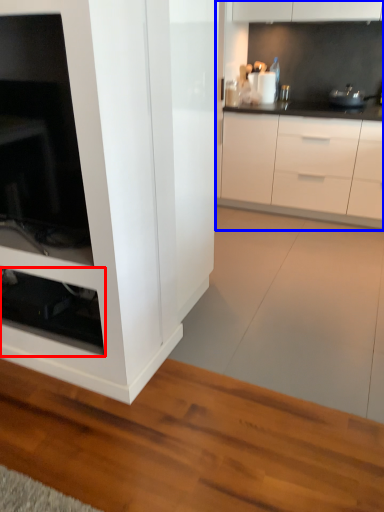
Question: Which of the following is the closest to the observer, shelf (highlighted by a red box) or cabinetry (highlighted by a blue box)?

Choices:
 (A) shelf
 (B) cabinetry

Answer: (A)